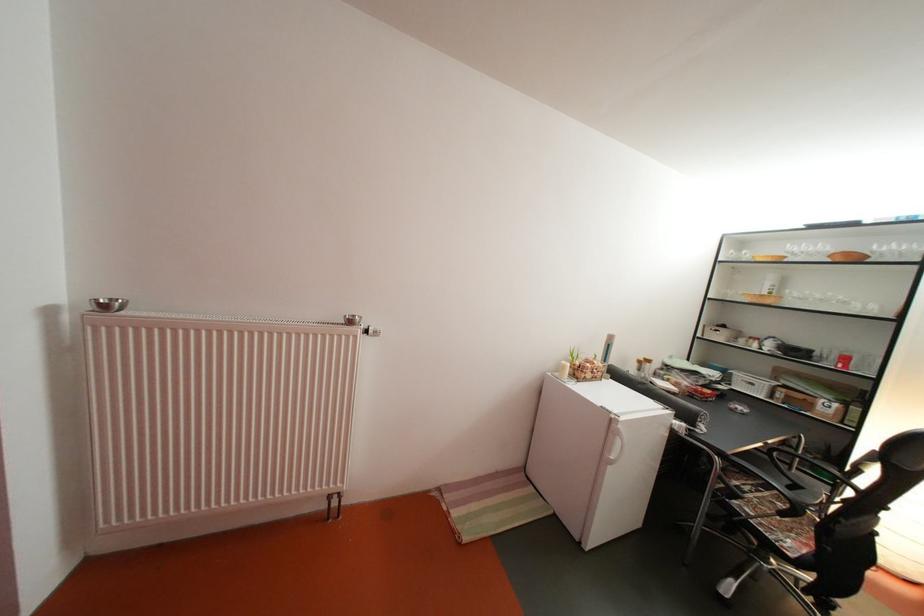
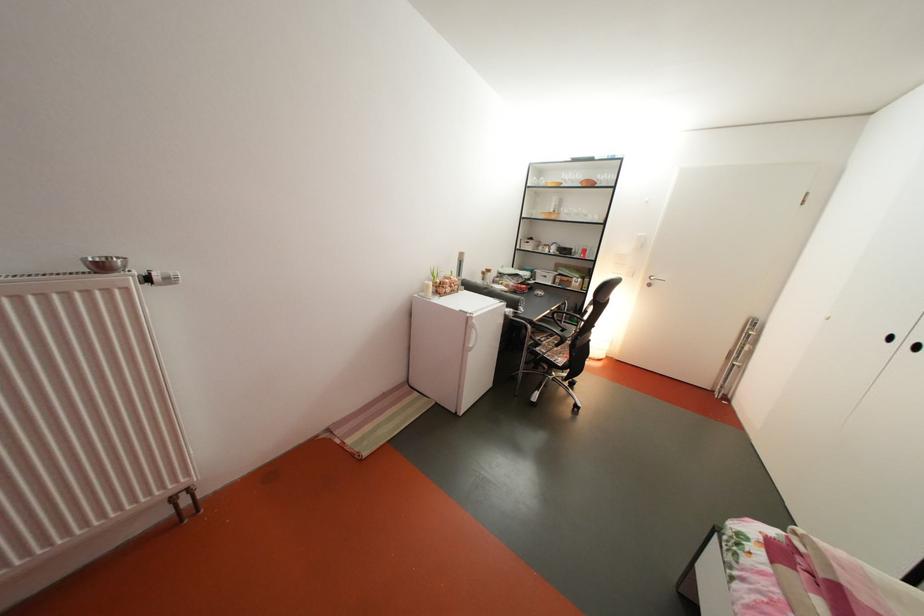
In the second image, find the point that corresponds to point 806,261 in the first image.

(578, 188)